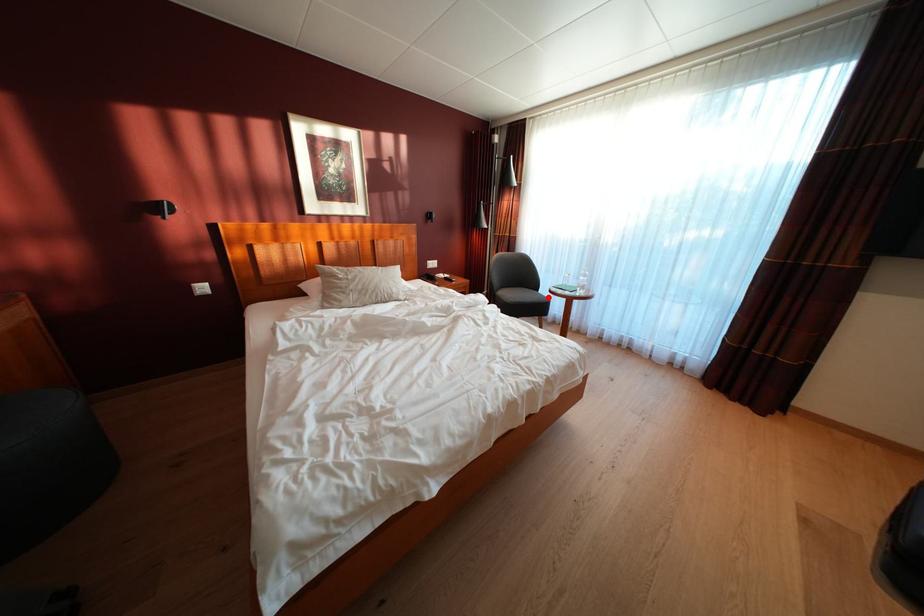
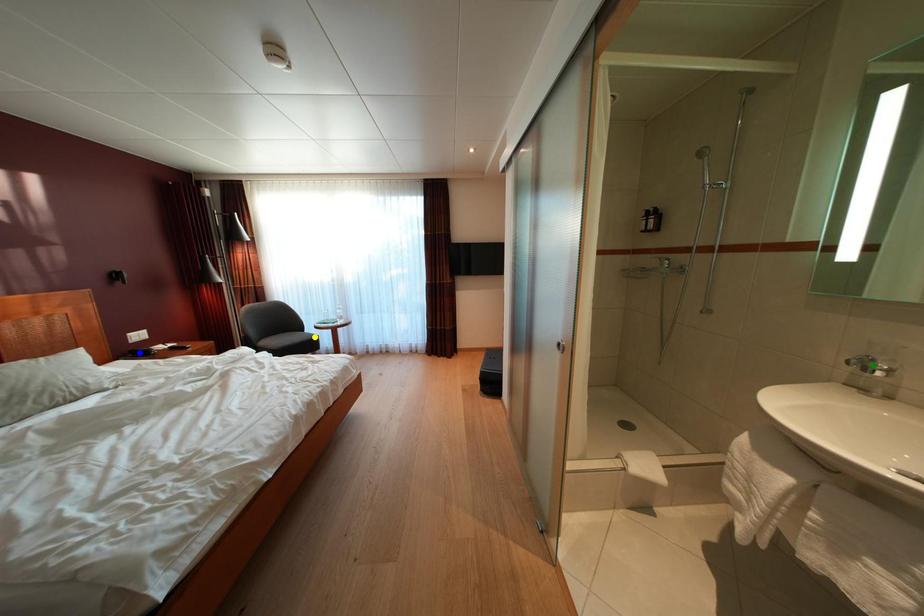
Question: I am providing you with two images of the same scene from different viewpoints. A red point is marked on the first image. You are given multiple points on the second image. In image 2, which mark is for the same physical point as the one in image 1?

Choices:
 (A) blue point
 (B) yellow point
 (C) green point

Answer: (B)